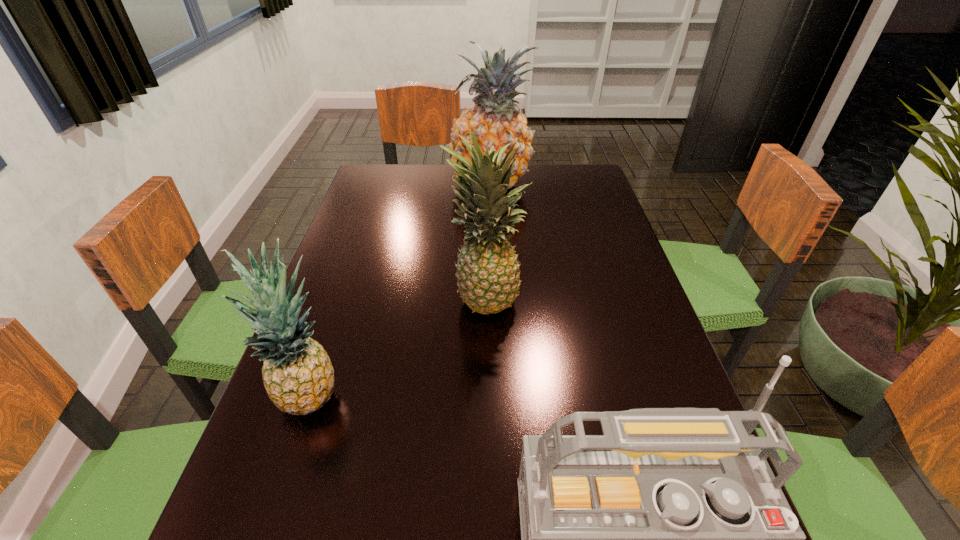
Image resolution: width=960 pixels, height=540 pixels. I want to click on free location that satisfies the following two spatial constraints: 1. on the back side of the third nearest object; 2. on the right side of the leftmost object, so click(x=344, y=295).

At what (x,y) coordinates should I click in order to perform the action: click on vacant area that satisfies the following two spatial constraints: 1. on the back side of the farthest pineapple; 2. on the left side of the leftmost pineapple. Please return your answer as a coordinate pair (x, y). This screenshot has height=540, width=960. Looking at the image, I should click on (x=381, y=184).

Where is `vacant region that satisfies the following two spatial constraints: 1. on the back side of the third farthest object; 2. on the right side of the third nearest object`? The height and width of the screenshot is (540, 960). vacant region that satisfies the following two spatial constraints: 1. on the back side of the third farthest object; 2. on the right side of the third nearest object is located at coordinates (344, 295).